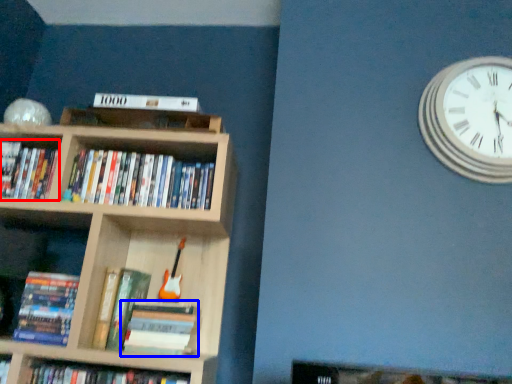
Question: Among these objects, which one is farthest to the camera, book (highlighted by a red box) or book (highlighted by a blue box)?

Choices:
 (A) book
 (B) book

Answer: (A)